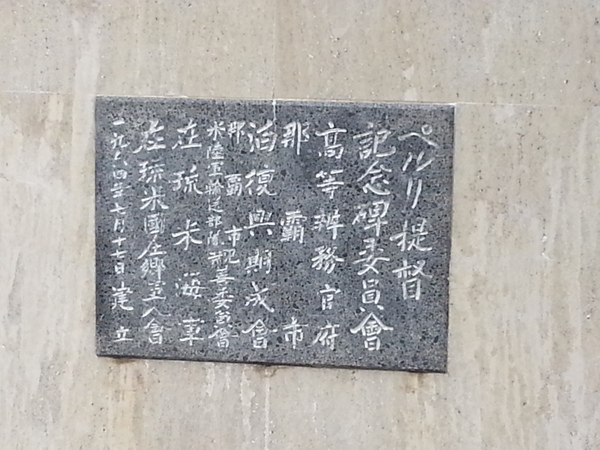
You are a GUI agent. You are given a task and a screenshot of the screen. Output one action in this format:
    pyautogui.click(x=<x>, y=<y>)
    Task: Click on the tile
    
    Given the screenshot: What is the action you would take?
    pyautogui.click(x=527, y=197)